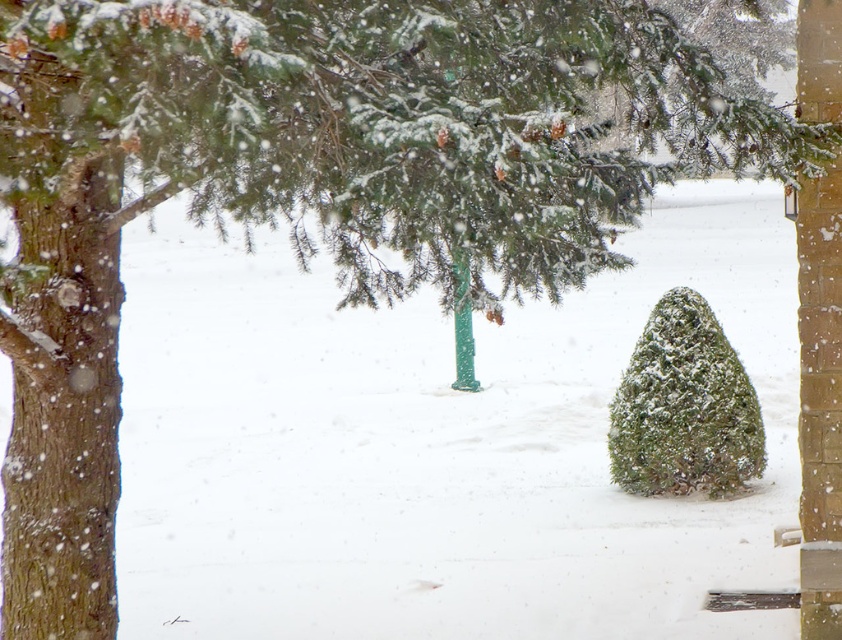
Is green textured fir tree at center to the left of green plastic pole at center from the viewer's perspective?

In fact, green textured fir tree at center is to the right of green plastic pole at center.

Which is more to the right, green textured fir tree at center or green plastic pole at center?

green textured fir tree at center is more to the right.

The width and height of the screenshot is (842, 640). Identify the location of green textured fir tree at center. (685, 406).